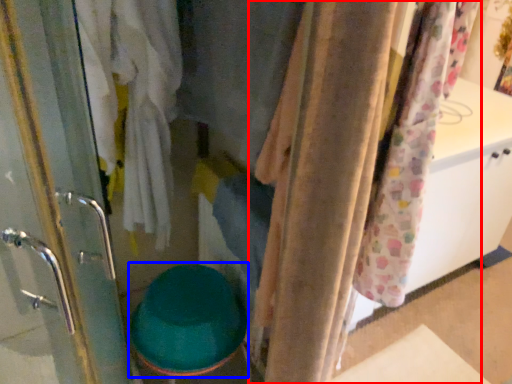
Question: Among these objects, which one is farthest to the camera, curtain (highlighted by a red box) or toilet bowl (highlighted by a blue box)?

Choices:
 (A) curtain
 (B) toilet bowl

Answer: (B)